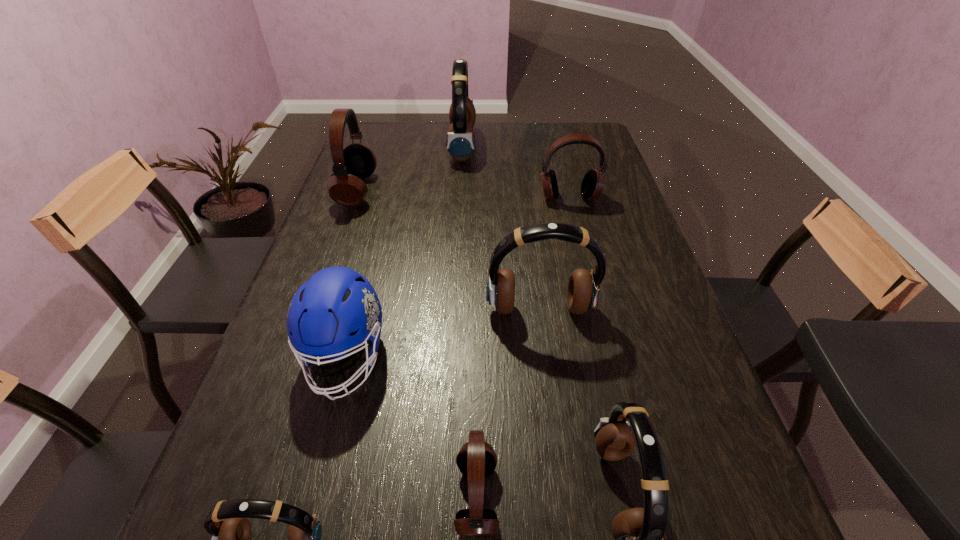
Find the location of a particular element. Image resolution: width=960 pixels, height=540 pixels. vacant position in the image that satisfies the following two spatial constraints: 1. on the ear cup of the biggest brown headset; 2. on the face guard of the blue football helmet is located at coordinates (449, 357).